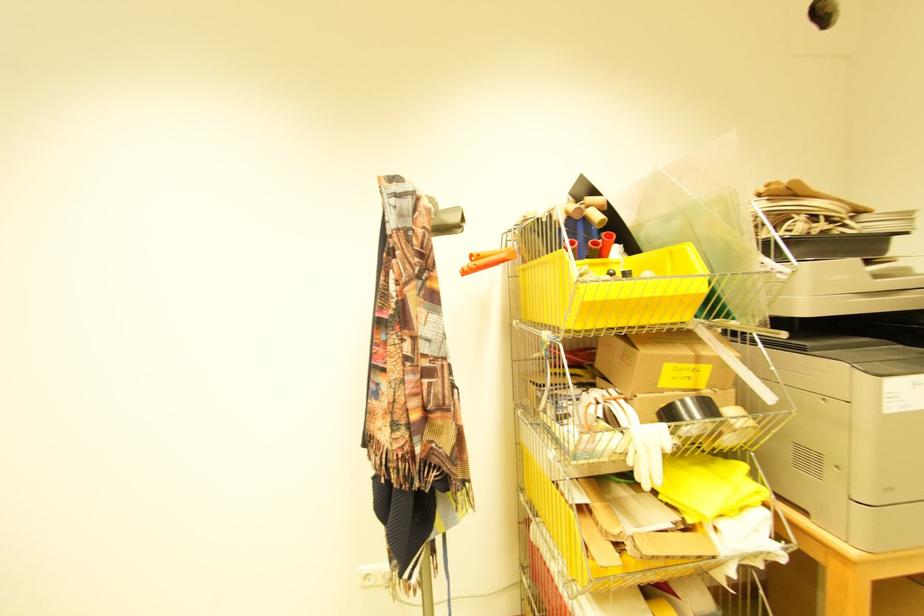
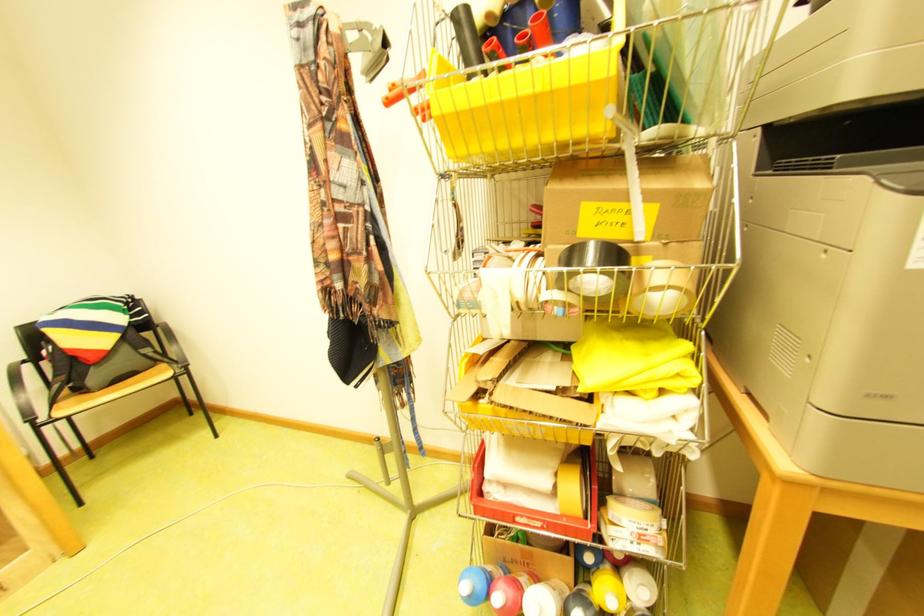
In the scene shown: First-person continuous shooting, in which direction is the camera rotating?

The camera rotated toward left-down.